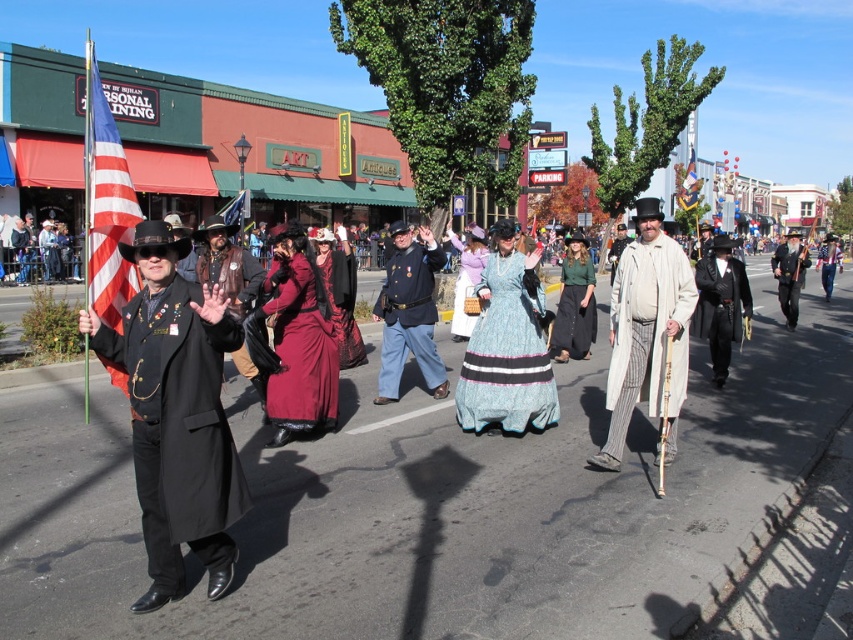
Can you confirm if matte black coat at left is thinner than matte blue flag at center?

Yes, matte black coat at left is thinner than matte blue flag at center.

Describe the element at coordinates (178, 426) in the screenshot. I see `matte black coat at left` at that location.

Is point (138, 292) positioned after point (692, 164)?

No.

You are a GUI agent. You are given a task and a screenshot of the screen. Output one action in this format:
    pyautogui.click(x=<x>, y=<y>)
    Task: Click on the matte black coat at left
    The image size is (853, 640).
    Given the screenshot: What is the action you would take?
    pyautogui.click(x=178, y=426)

Does american flag at left have a smaller size compared to matte blue flag at center?

No.

What do you see at coordinates (106, 204) in the screenshot? The width and height of the screenshot is (853, 640). I see `american flag at left` at bounding box center [106, 204].

Is point (96, 269) farther from camera compared to point (695, 193)?

No, (96, 269) is closer to viewer.

The height and width of the screenshot is (640, 853). Identify the location of american flag at left. [x=106, y=204].

Is point (421, 236) in front of point (693, 202)?

Yes, point (421, 236) is closer to viewer.

Is blue denim pants at center taller than matte blue flag at center?

No, blue denim pants at center is not taller than matte blue flag at center.

Locate an element on the screen. The height and width of the screenshot is (640, 853). blue denim pants at center is located at coordinates (409, 312).

This screenshot has height=640, width=853. I want to click on blue denim pants at center, so click(x=409, y=312).